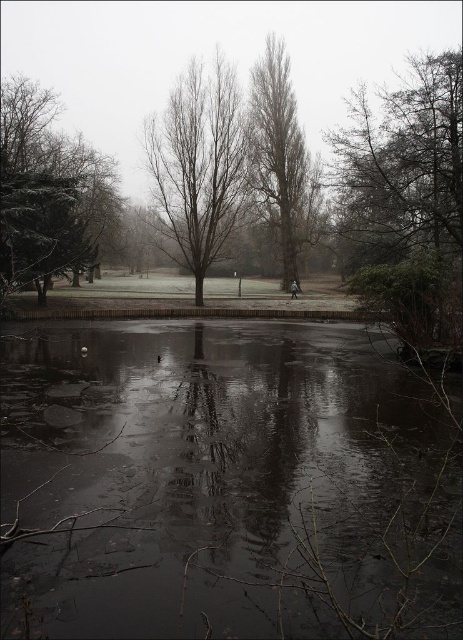
You are standing at the center of the paved path in the middle ground of the winter scene. You want to locate the smooth brown tree at right. In which direction should you look to find it?

You should look to your right to find the smooth brown tree at right, as it is located at point (406,182), which corresponds to the right side of the scene.